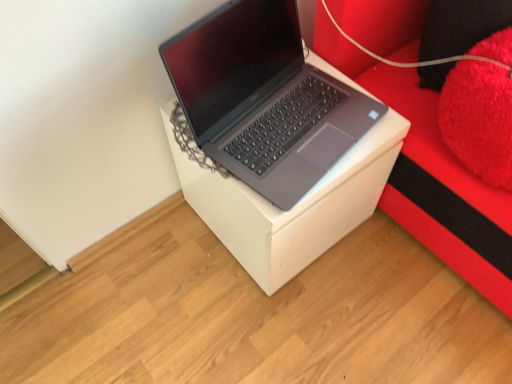
Locate an element on the screen. The width and height of the screenshot is (512, 384). empty space that is ontop of white cardboard box at center is located at coordinates (289, 114).